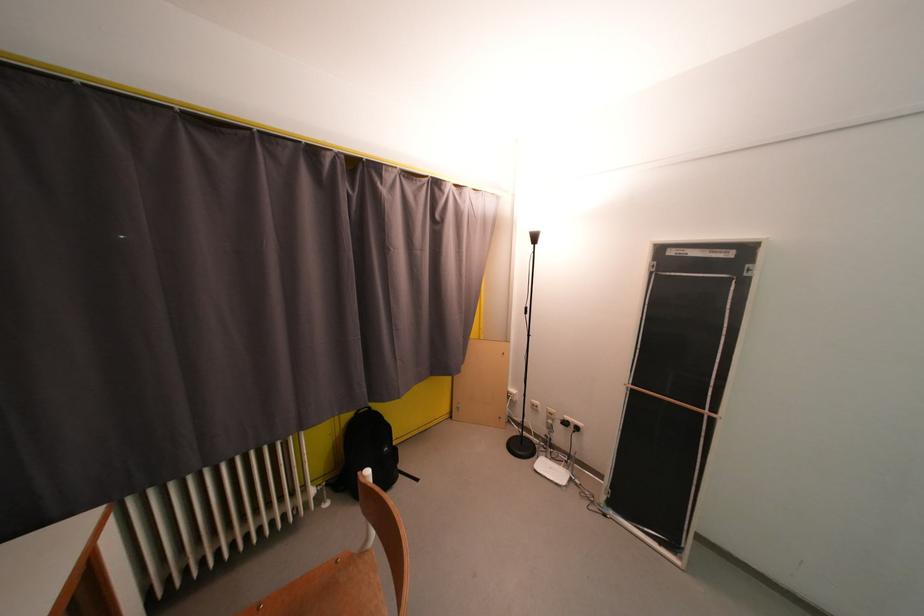
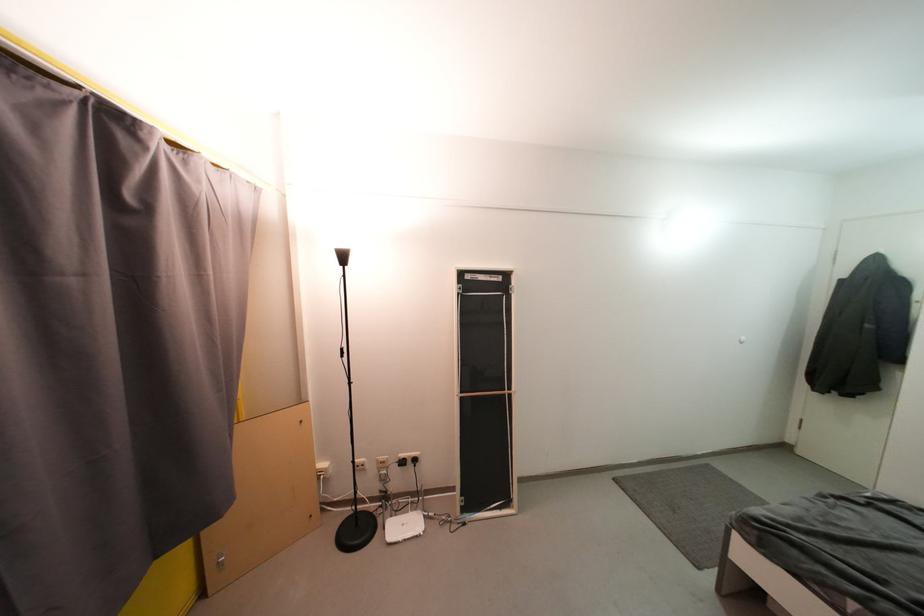
Find the pixel in the second image that matches [468,197] in the first image.

(192, 166)